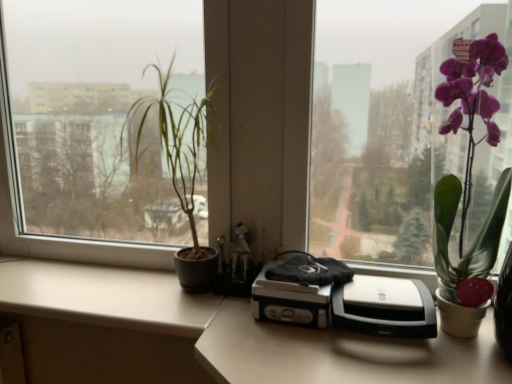
Question: From a real-world perspective, is silver/black plastic printer at center positioned under beige matte counter top at lower left based on gravity?

Choices:
 (A) yes
 (B) no

Answer: (B)

Question: Are silver/black plastic printer at center and beige matte counter top at lower left far apart?

Choices:
 (A) yes
 (B) no

Answer: (B)

Question: From the image's perspective, is silver/black plastic printer at center on top of beige matte counter top at lower left?

Choices:
 (A) no
 (B) yes

Answer: (B)

Question: Can you confirm if silver/black plastic printer at center is smaller than beige matte counter top at lower left?

Choices:
 (A) yes
 (B) no

Answer: (A)

Question: Considering the relative positions of silver/black plastic printer at center and beige matte counter top at lower left in the image provided, is silver/black plastic printer at center to the left of beige matte counter top at lower left from the viewer's perspective?

Choices:
 (A) yes
 (B) no

Answer: (B)

Question: Considering the positions of beige matte counter top at lower left and silver/black plastic printer at center in the image, is beige matte counter top at lower left wider or thinner than silver/black plastic printer at center?

Choices:
 (A) thin
 (B) wide

Answer: (B)

Question: From the image's perspective, is beige matte counter top at lower left located above or below silver/black plastic printer at center?

Choices:
 (A) below
 (B) above

Answer: (A)

Question: Is beige matte counter top at lower left to the left or to the right of silver/black plastic printer at center in the image?

Choices:
 (A) left
 (B) right

Answer: (A)

Question: Is beige matte counter top at lower left taller or shorter than silver/black plastic printer at center?

Choices:
 (A) short
 (B) tall

Answer: (A)

Question: Is point (423, 326) closer or farther from the camera than point (182, 203)?

Choices:
 (A) closer
 (B) farther

Answer: (A)

Question: Is silver/black plastic printer at center in front of or behind green matte plant at left, which is the second houseplant from right to left, in the image?

Choices:
 (A) behind
 (B) front

Answer: (B)

Question: From the image's perspective, relative to green matte plant at left, positioned as the 1th houseplant in left-to-right order, is silver/black plastic printer at center above or below?

Choices:
 (A) above
 (B) below

Answer: (B)

Question: From a real-world perspective, is silver/black plastic printer at center physically located above or below green matte plant at left, which is the second houseplant from right to left?

Choices:
 (A) below
 (B) above

Answer: (A)

Question: Is silver/black plastic printer at center to the left or to the right of beige matte counter top at lower left in the image?

Choices:
 (A) right
 (B) left

Answer: (A)

Question: From their relative heights in the image, would you say silver/black plastic printer at center is taller or shorter than beige matte counter top at lower left?

Choices:
 (A) tall
 (B) short

Answer: (A)